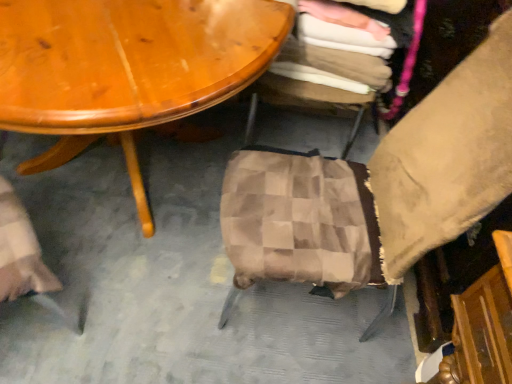
Describe the element at coordinates (328, 65) in the screenshot. I see `checkered fabric stool at center, the second chair when ordered from front to back` at that location.

You are a GUI agent. You are given a task and a screenshot of the screen. Output one action in this format:
    pyautogui.click(x=<x>, y=<y>)
    Task: Click on the checkered fabric stool at center, the 1th chair viewed from the back
    
    Given the screenshot: What is the action you would take?
    pyautogui.click(x=328, y=65)

Measure the distance between brown checkered fabric at center, acting as the first chair starting from the front, and camera.

They are 30.14 inches apart.

The width and height of the screenshot is (512, 384). I want to click on brown checkered fabric at center, arranged as the second chair when viewed from the back, so click(x=377, y=187).

Image resolution: width=512 pixels, height=384 pixels. Describe the element at coordinates (377, 187) in the screenshot. I see `brown checkered fabric at center, acting as the first chair starting from the front` at that location.

Locate an element on the screen. The image size is (512, 384). checkered fabric stool at center, the second chair when ordered from front to back is located at coordinates (328, 65).

Does checkered fabric stool at center, the 1th chair viewed from the back, appear on the right side of brown checkered fabric at center, acting as the first chair starting from the front?

Correct, you'll find checkered fabric stool at center, the 1th chair viewed from the back, to the right of brown checkered fabric at center, acting as the first chair starting from the front.

Is checkered fabric stool at center, the 1th chair viewed from the back, in front of or behind brown checkered fabric at center, arranged as the second chair when viewed from the back, in the image?

In the image, checkered fabric stool at center, the 1th chair viewed from the back, appears behind brown checkered fabric at center, arranged as the second chair when viewed from the back.

Does point (316, 44) lie behind point (464, 198)?

Yes, it is.

Consider the image. From the image's perspective, which is below, checkered fabric stool at center, the 1th chair viewed from the back, or brown checkered fabric at center, acting as the first chair starting from the front?

From the image's view, brown checkered fabric at center, acting as the first chair starting from the front, is below.

Consider the image. From a real-world perspective, is checkered fabric stool at center, the 1th chair viewed from the back, positioned above or below brown checkered fabric at center, acting as the first chair starting from the front?

Clearly, from a real-world perspective, checkered fabric stool at center, the 1th chair viewed from the back, is below brown checkered fabric at center, acting as the first chair starting from the front.

Which of these two, checkered fabric stool at center, the second chair when ordered from front to back, or brown checkered fabric at center, arranged as the second chair when viewed from the back, is thinner?

Thinner between the two is brown checkered fabric at center, arranged as the second chair when viewed from the back.

Does checkered fabric stool at center, the 1th chair viewed from the back, have a lesser height compared to brown checkered fabric at center, acting as the first chair starting from the front?

Yes.

Who is bigger, checkered fabric stool at center, the 1th chair viewed from the back, or brown checkered fabric at center, arranged as the second chair when viewed from the back?

With larger size is brown checkered fabric at center, arranged as the second chair when viewed from the back.

Is checkered fabric stool at center, the second chair when ordered from front to back, not within brown checkered fabric at center, arranged as the second chair when viewed from the back?

Yes, checkered fabric stool at center, the second chair when ordered from front to back, is outside of brown checkered fabric at center, arranged as the second chair when viewed from the back.

Are checkered fabric stool at center, the 1th chair viewed from the back, and brown checkered fabric at center, arranged as the second chair when viewed from the back, located far from each other?

No, checkered fabric stool at center, the 1th chair viewed from the back, is in close proximity to brown checkered fabric at center, arranged as the second chair when viewed from the back.

Is brown checkered fabric at center, arranged as the second chair when viewed from the back, at the back of checkered fabric stool at center, the 1th chair viewed from the back?

checkered fabric stool at center, the 1th chair viewed from the back, does not have its back to brown checkered fabric at center, arranged as the second chair when viewed from the back.

Locate an element on the screen. chair lying behind the brown checkered fabric at center, acting as the first chair starting from the front is located at coordinates (328, 65).

Does brown checkered fabric at center, acting as the first chair starting from the front, appear on the right side of checkered fabric stool at center, the second chair when ordered from front to back?

In fact, brown checkered fabric at center, acting as the first chair starting from the front, is to the left of checkered fabric stool at center, the second chair when ordered from front to back.

Is brown checkered fabric at center, arranged as the second chair when viewed from the back, in front of or behind checkered fabric stool at center, the 1th chair viewed from the back, in the image?

Visually, brown checkered fabric at center, arranged as the second chair when viewed from the back, is located in front of checkered fabric stool at center, the 1th chair viewed from the back.

Which is nearer, (439, 198) or (281, 83)?

Point (439, 198) is closer to the camera than point (281, 83).

From the image's perspective, is brown checkered fabric at center, arranged as the second chair when viewed from the back, under checkered fabric stool at center, the 1th chair viewed from the back?

Indeed, from the image's perspective, brown checkered fabric at center, arranged as the second chair when viewed from the back, is shown beneath checkered fabric stool at center, the 1th chair viewed from the back.

From a real-world perspective, is brown checkered fabric at center, arranged as the second chair when viewed from the back, located higher than checkered fabric stool at center, the second chair when ordered from front to back?

Indeed, from a real-world perspective, brown checkered fabric at center, arranged as the second chair when viewed from the back, stands above checkered fabric stool at center, the second chair when ordered from front to back.

Is brown checkered fabric at center, arranged as the second chair when viewed from the back, thinner than checkered fabric stool at center, the second chair when ordered from front to back?

Indeed, brown checkered fabric at center, arranged as the second chair when viewed from the back, has a lesser width compared to checkered fabric stool at center, the second chair when ordered from front to back.

Which of these two, brown checkered fabric at center, arranged as the second chair when viewed from the back, or checkered fabric stool at center, the second chair when ordered from front to back, stands taller?

brown checkered fabric at center, arranged as the second chair when viewed from the back, is taller.

Between brown checkered fabric at center, arranged as the second chair when viewed from the back, and checkered fabric stool at center, the 1th chair viewed from the back, which one has smaller size?

With smaller size is checkered fabric stool at center, the 1th chair viewed from the back.

Is brown checkered fabric at center, arranged as the second chair when viewed from the back, inside the boundaries of checkered fabric stool at center, the 1th chair viewed from the back, or outside?

brown checkered fabric at center, arranged as the second chair when viewed from the back, is not enclosed by checkered fabric stool at center, the 1th chair viewed from the back.

Is brown checkered fabric at center, acting as the first chair starting from the front, with checkered fabric stool at center, the second chair when ordered from front to back?

brown checkered fabric at center, acting as the first chair starting from the front, and checkered fabric stool at center, the second chair when ordered from front to back, are clearly separated.

Based on the photo, does brown checkered fabric at center, arranged as the second chair when viewed from the back, turn towards checkered fabric stool at center, the 1th chair viewed from the back?

No.

Measure the distance between brown checkered fabric at center, arranged as the second chair when viewed from the back, and checkered fabric stool at center, the second chair when ordered from front to back.

They are 18.49 inches apart.

Locate an element on the screen. This screenshot has width=512, height=384. chair below the checkered fabric stool at center, the 1th chair viewed from the back (from the image's perspective) is located at coordinates (377, 187).

What are the coordinates of `chair lying below the checkered fabric stool at center, the 1th chair viewed from the back (from the image's perspective)` in the screenshot? It's located at (377, 187).

Identify the location of chair below the brown checkered fabric at center, acting as the first chair starting from the front (from a real-world perspective). (328, 65).